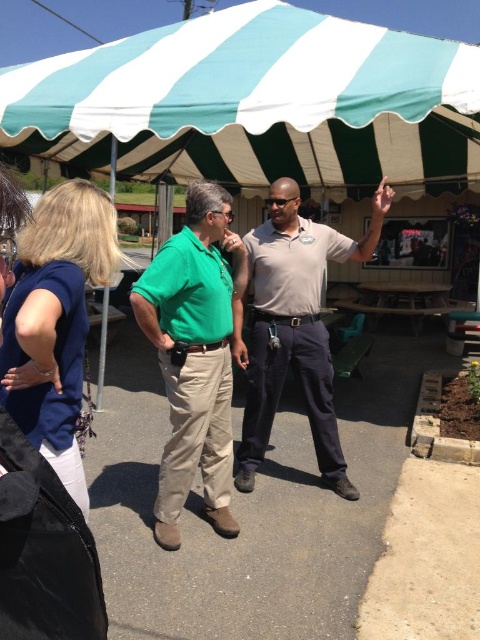
How distant is green cotton shirt at center from matte khaki pants at center?

green cotton shirt at center and matte khaki pants at center are 21.76 inches apart from each other.

Is green cotton shirt at center to the left of matte khaki pants at center from the viewer's perspective?

Correct, you'll find green cotton shirt at center to the left of matte khaki pants at center.

Is point (242, 253) positioned before point (276, 291)?

Yes.

This screenshot has width=480, height=640. I want to click on green cotton shirt at center, so click(194, 356).

Does teal/white striped canopy at upper center have a smaller size compared to matte khaki pants at center?

Yes.

Can you confirm if teal/white striped canopy at upper center is positioned to the left of matte khaki pants at center?

Incorrect, teal/white striped canopy at upper center is not on the left side of matte khaki pants at center.

Identify the location of teal/white striped canopy at upper center. This screenshot has height=640, width=480. (255, 100).

Who is positioned more to the right, teal/white striped canopy at upper center or green cotton shirt at center?

teal/white striped canopy at upper center is more to the right.

What do you see at coordinates (255, 100) in the screenshot?
I see `teal/white striped canopy at upper center` at bounding box center [255, 100].

Does point (52, 58) come in front of point (243, 353)?

No.

Where is `teal/white striped canopy at upper center`? teal/white striped canopy at upper center is located at coordinates click(255, 100).